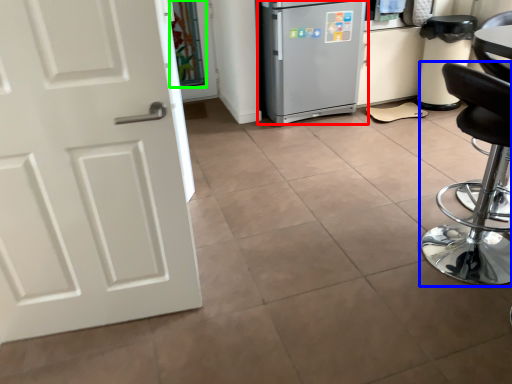
Question: Considering the real-world distances, which object is closest to refrigerator (highlighted by a red box)? chair (highlighted by a blue box) or glass door (highlighted by a green box).

Choices:
 (A) chair
 (B) glass door

Answer: (B)